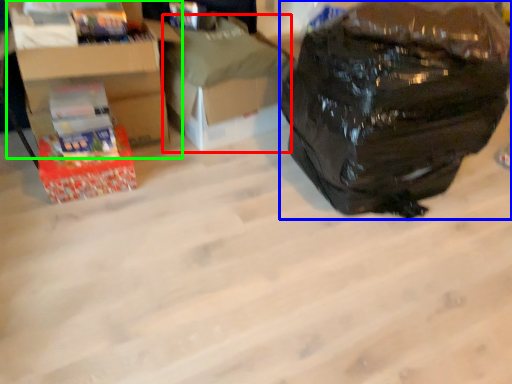
Question: Considering the real-world distances, which object is closest to cardboard box (highlighted by a red box)? backpack (highlighted by a blue box) or cardboard box (highlighted by a green box).

Choices:
 (A) backpack
 (B) cardboard box

Answer: (B)